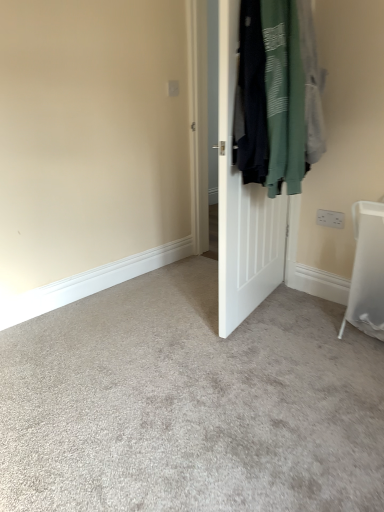
Question: From a real-world perspective, is white plastic electric outlet at upper right physically located above or below dark green cotton sweatshirt at right?

Choices:
 (A) below
 (B) above

Answer: (A)

Question: Considering their positions, is white plastic electric outlet at upper right located in front of or behind dark green cotton sweatshirt at right?

Choices:
 (A) behind
 (B) front

Answer: (A)

Question: Which object is positioned farthest from the dark green cotton sweatshirt at right?

Choices:
 (A) white plastic electric outlet at upper right
 (B) white matte door at center

Answer: (A)

Question: Considering the real-world distances, which object is farthest from the dark green cotton sweatshirt at right?

Choices:
 (A) white plastic electric outlet at upper right
 (B) white matte door at center

Answer: (A)